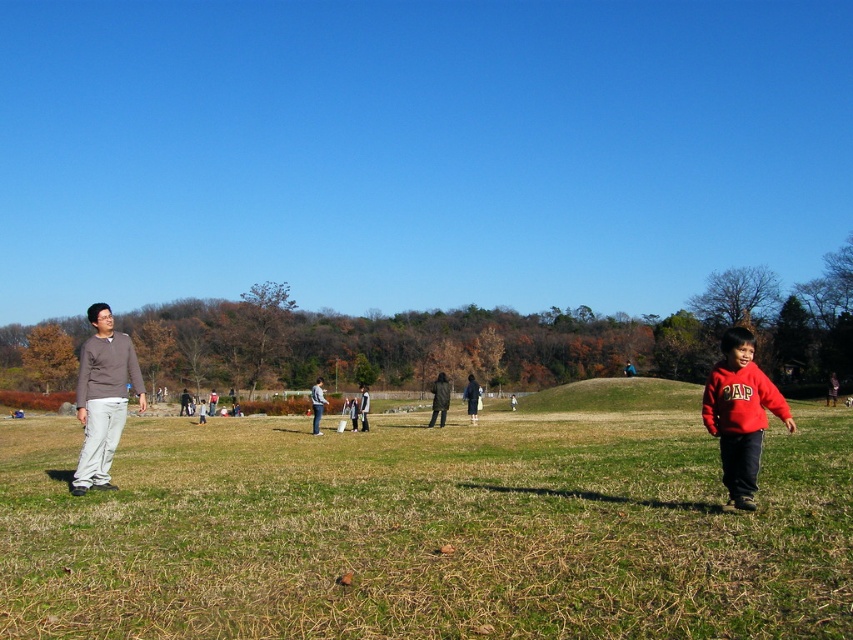
Question: Estimate the real-world distances between objects in this image. Which object is closer to the dark gray jacket at center?

Choices:
 (A) dark gray coat at center
 (B) green grass at center
 (C) brown cotton sweater at left
 (D) red fleece sweatshirt at lower right

Answer: (A)

Question: Does green grass at center have a greater width compared to dark gray jacket at center?

Choices:
 (A) yes
 (B) no

Answer: (A)

Question: Among these points, which one is farthest from the camera?

Choices:
 (A) (517, 502)
 (B) (467, 403)
 (C) (450, 396)

Answer: (B)

Question: Among these points, which one is nearest to the camera?

Choices:
 (A) (440, 419)
 (B) (474, 385)
 (C) (248, 417)

Answer: (A)

Question: Does red fleece sweatshirt at lower right appear under dark gray jacket at center?

Choices:
 (A) yes
 (B) no

Answer: (B)

Question: Can you confirm if brown cotton sweater at left is positioned below dark gray coat at center?

Choices:
 (A) no
 (B) yes

Answer: (A)